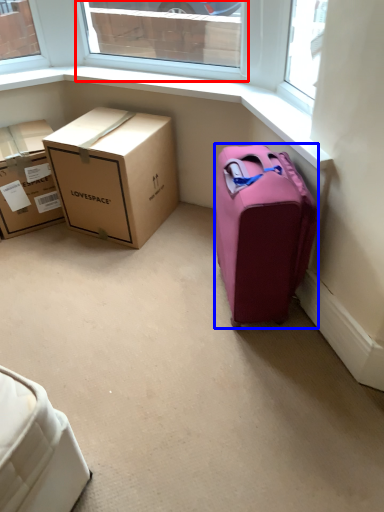
Question: Which of the following is the farthest to the observer, window (highlighted by a red box) or suitcase (highlighted by a blue box)?

Choices:
 (A) window
 (B) suitcase

Answer: (A)